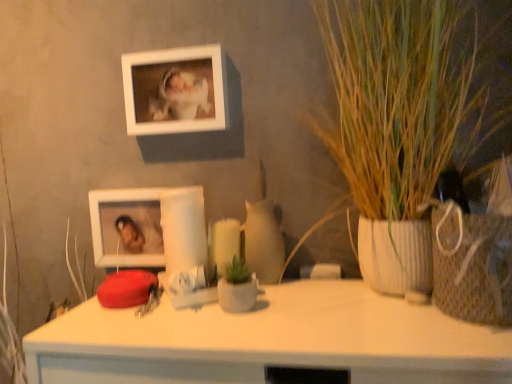
Question: From a real-world perspective, is green textured plant at right under white glossy picture frame at lower left, acting as the second picture frame starting from the top?

Choices:
 (A) yes
 (B) no

Answer: (B)

Question: Is green textured plant at right aimed at white glossy picture frame at lower left, marked as the first picture frame in a bottom-to-top arrangement?

Choices:
 (A) no
 (B) yes

Answer: (A)

Question: From a real-world perspective, is green textured plant at right over white glossy picture frame at lower left, acting as the second picture frame starting from the top?

Choices:
 (A) yes
 (B) no

Answer: (A)

Question: Considering the relative sizes of green textured plant at right and white glossy picture frame at lower left, marked as the first picture frame in a bottom-to-top arrangement, in the image provided, is green textured plant at right shorter than white glossy picture frame at lower left, marked as the first picture frame in a bottom-to-top arrangement,?

Choices:
 (A) no
 (B) yes

Answer: (A)

Question: Is green textured plant at right bigger than white glossy picture frame at lower left, marked as the first picture frame in a bottom-to-top arrangement?

Choices:
 (A) yes
 (B) no

Answer: (A)

Question: Considering the positions of green textured plant at right and matte white candle at center in the image, is green textured plant at right wider or thinner than matte white candle at center?

Choices:
 (A) wide
 (B) thin

Answer: (A)

Question: Considering the positions of green textured plant at right and matte white candle at center in the image, is green textured plant at right bigger or smaller than matte white candle at center?

Choices:
 (A) big
 (B) small

Answer: (A)

Question: From their relative heights in the image, would you say green textured plant at right is taller or shorter than matte white candle at center?

Choices:
 (A) tall
 (B) short

Answer: (A)

Question: From a real-world perspective, is green textured plant at right above or below matte white candle at center?

Choices:
 (A) below
 (B) above

Answer: (B)

Question: From the image's perspective, is green textured plant at right located above or below white glossy picture frame at lower left, marked as the first picture frame in a bottom-to-top arrangement?

Choices:
 (A) below
 (B) above

Answer: (B)

Question: In terms of height, does green textured plant at right look taller or shorter compared to white glossy picture frame at lower left, marked as the first picture frame in a bottom-to-top arrangement?

Choices:
 (A) tall
 (B) short

Answer: (A)

Question: Is green textured plant at right wider or thinner than white glossy picture frame at lower left, marked as the first picture frame in a bottom-to-top arrangement?

Choices:
 (A) thin
 (B) wide

Answer: (B)

Question: Considering the positions of point (337, 157) and point (113, 238), is point (337, 157) closer or farther from the camera than point (113, 238)?

Choices:
 (A) farther
 (B) closer

Answer: (B)

Question: Choose the correct answer: Is matte white candle at center inside white matte picture frame at upper center, the 1th picture frame from the top, or outside it?

Choices:
 (A) outside
 (B) inside

Answer: (A)

Question: From a real-world perspective, relative to white matte picture frame at upper center, marked as the second picture frame in a bottom-to-top arrangement, is matte white candle at center vertically above or below?

Choices:
 (A) below
 (B) above

Answer: (A)